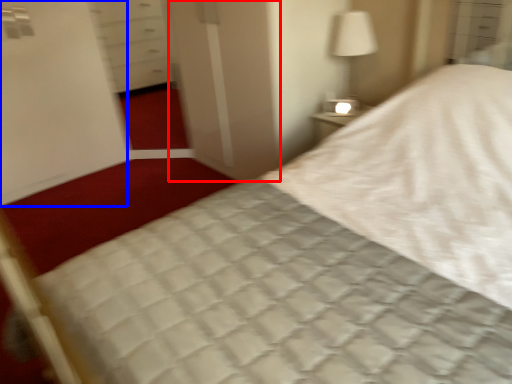
Question: Among these objects, which one is farthest to the camera, screen door (highlighted by a red box) or screen door (highlighted by a blue box)?

Choices:
 (A) screen door
 (B) screen door

Answer: (B)